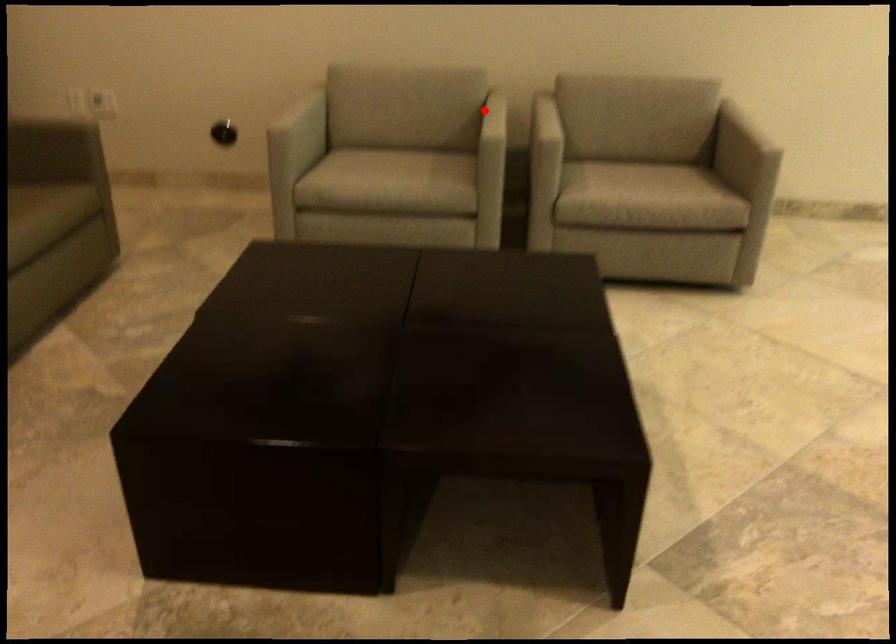
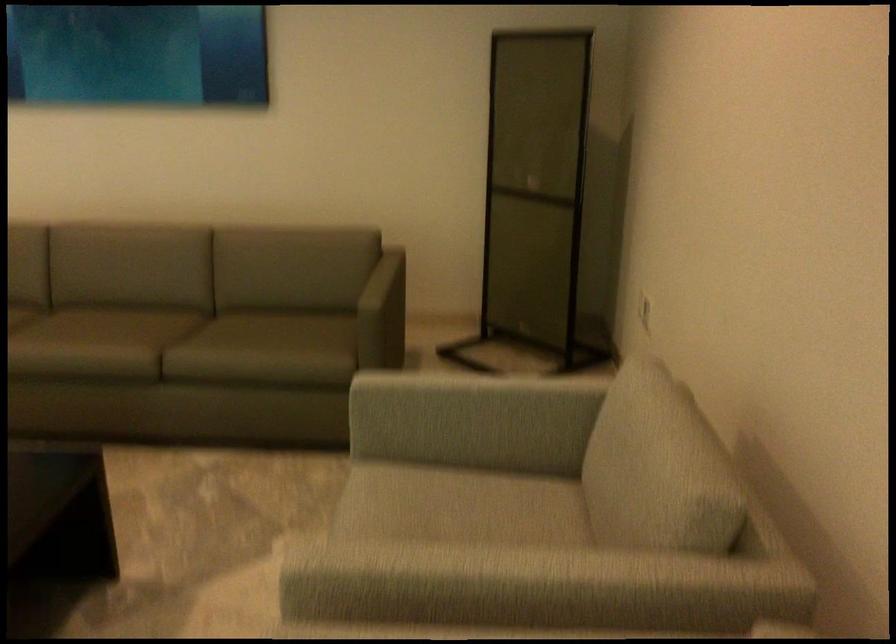
Question: I am providing you with two images of the same scene from different viewpoints. Image1 has a red point marked. In image2, the corresponding 3D location appears at what relative position? Reply with the corresponding letter.

Choices:
 (A) Closer
 (B) Farther

Answer: (A)